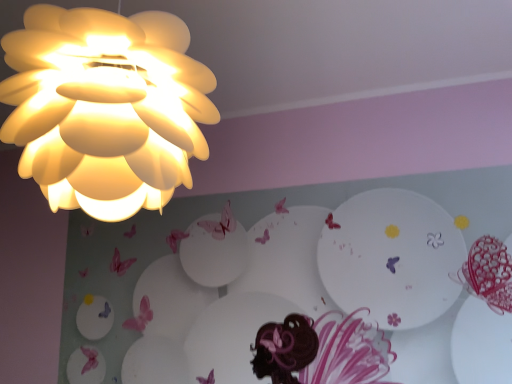
Find the location of a particular element. The height and width of the screenshot is (384, 512). matte yellow flower at upper left is located at coordinates (105, 107).

The image size is (512, 384). What do you see at coordinates (105, 107) in the screenshot?
I see `matte yellow flower at upper left` at bounding box center [105, 107].

This screenshot has width=512, height=384. In order to click on matte yellow flower at upper left in this screenshot , I will do `click(105, 107)`.